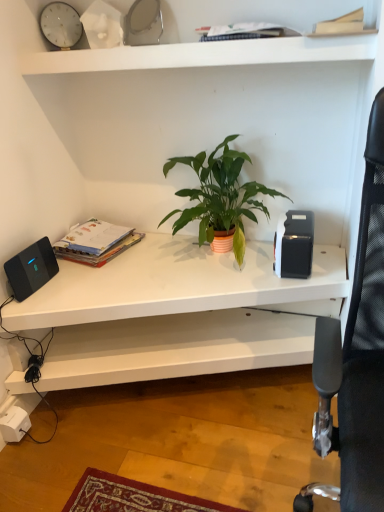
Image resolution: width=384 pixels, height=512 pixels. What are the coordinates of `free point below green matte plant at center (from a real-world perspective)` in the screenshot? It's located at (208, 258).